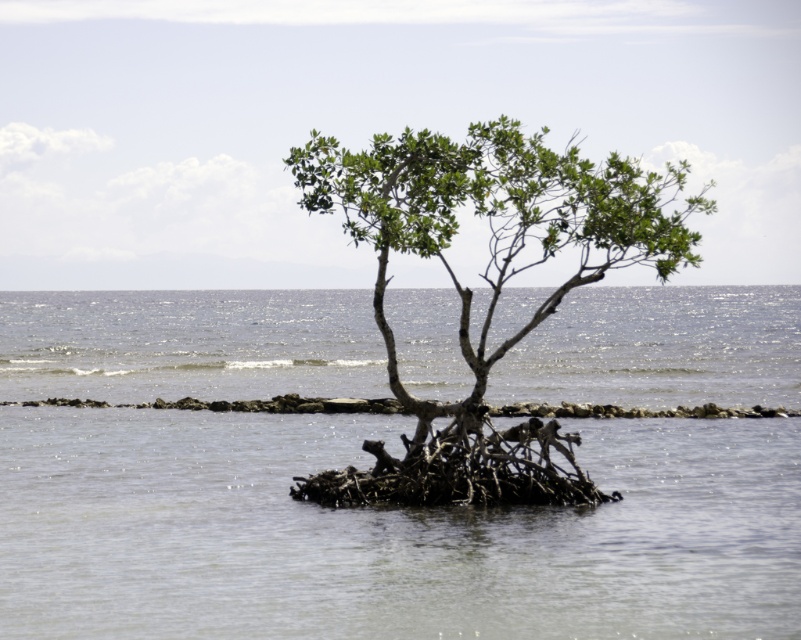
Question: Which is nearer to the green leafy tree at center?

Choices:
 (A) brown/root-like at center
 (B) clear water at center
 (C) brown/rough rock at center

Answer: (A)

Question: Which of these objects is positioned farthest from the brown/root-like at center?

Choices:
 (A) green leafy tree at center
 (B) clear water at center
 (C) brown/rough rock at center

Answer: (B)

Question: Observing the image, what is the correct spatial positioning of clear water at center in reference to green leafy tree at center?

Choices:
 (A) left
 (B) right

Answer: (B)

Question: Is brown/root-like at center further to camera compared to brown/rough rock at center?

Choices:
 (A) no
 (B) yes

Answer: (A)

Question: Which of the following is the farthest from the observer?

Choices:
 (A) (312, 131)
 (B) (186, 520)
 (C) (276, 397)
 (D) (544, 465)

Answer: (C)

Question: Where is clear water at center located in relation to green leafy tree at center in the image?

Choices:
 (A) above
 (B) below

Answer: (A)